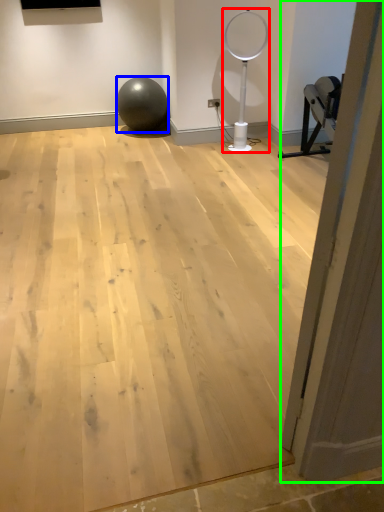
Question: Which object is positioned closest to basketball hoop (highlighted by a red box)? Select from ball (highlighted by a blue box) and door (highlighted by a green box).

Choices:
 (A) ball
 (B) door

Answer: (A)